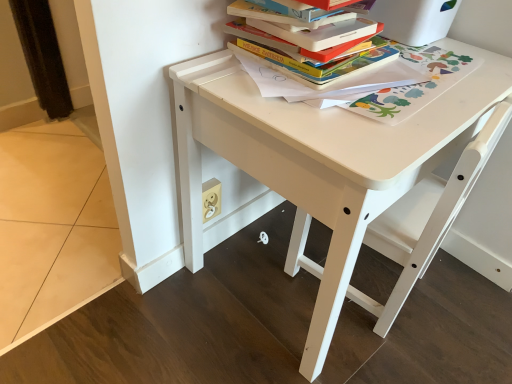
Question: Is white matte chair at center bigger or smaller than hardcover books at upper center?

Choices:
 (A) small
 (B) big

Answer: (B)

Question: Considering the positions of point (488, 155) and point (245, 46), is point (488, 155) closer or farther from the camera than point (245, 46)?

Choices:
 (A) closer
 (B) farther

Answer: (A)

Question: Which object is positioned closest to the hardcover book at upper center?

Choices:
 (A) hardcover books at upper center
 (B) white matte table at center
 (C) white matte chair at center

Answer: (A)

Question: Which is farther from the hardcover books at upper center?

Choices:
 (A) white matte chair at center
 (B) hardcover book at upper center
 (C) white matte table at center

Answer: (A)